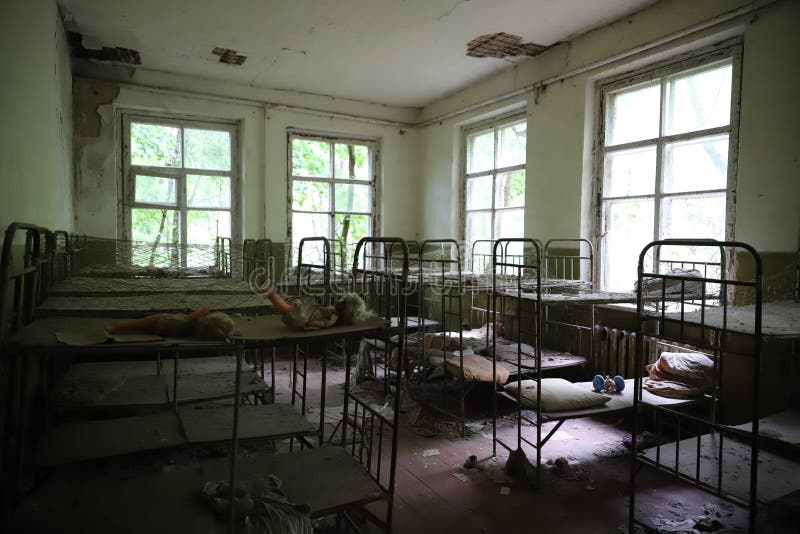
Locate an element on the screen. bed frame is located at coordinates (690, 418), (402, 245), (440, 240).